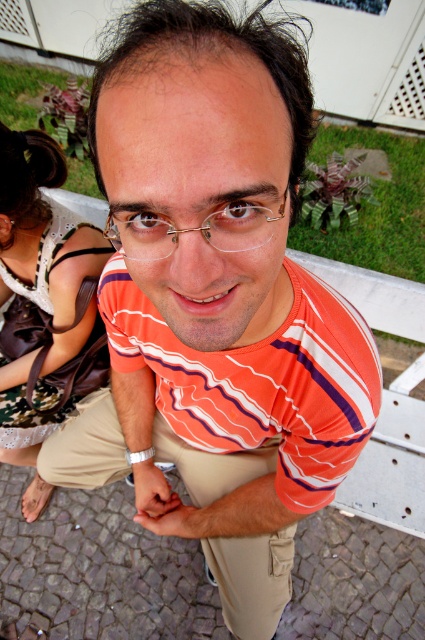
Question: Does brown leather purse at left have a lesser width compared to khaki pants at center?

Choices:
 (A) yes
 (B) no

Answer: (A)

Question: Which point appears closest to the camera in this image?

Choices:
 (A) (108, 220)
 (B) (16, 372)
 (C) (258, 576)

Answer: (A)

Question: Which of these objects is positioned closest to the khaki pants at center?

Choices:
 (A) brown leather purse at left
 (B) gold metallic glasses at center

Answer: (A)

Question: Based on their relative distances, which object is farther from the gold metallic glasses at center?

Choices:
 (A) khaki pants at center
 (B) brown leather purse at left

Answer: (B)

Question: Is brown leather purse at left wider than gold metallic glasses at center?

Choices:
 (A) yes
 (B) no

Answer: (A)

Question: Can you confirm if brown leather purse at left is wider than khaki pants at center?

Choices:
 (A) no
 (B) yes

Answer: (A)